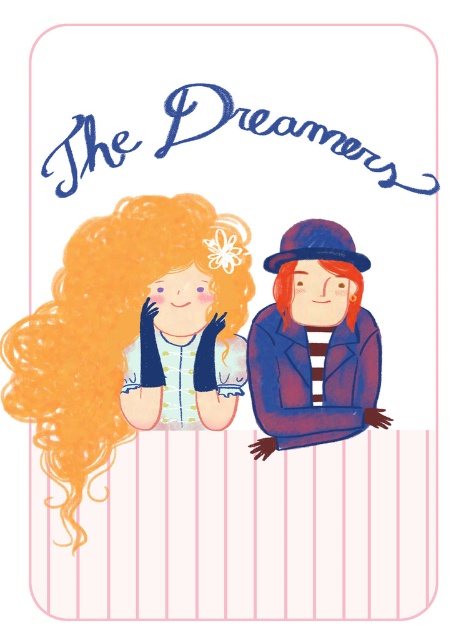
Does golden curly hair at left have a greater height compared to blonde curly hair at center?

Correct, golden curly hair at left is much taller as blonde curly hair at center.

Can you confirm if golden curly hair at left is positioned to the left of blonde curly hair at center?

Yes, golden curly hair at left is to the left of blonde curly hair at center.

Image resolution: width=466 pixels, height=640 pixels. I want to click on golden curly hair at left, so click(131, 337).

Who is positioned more to the left, matte blue hat at center or blonde curly hair at center?

Positioned to the left is blonde curly hair at center.

Where is `matte blue hat at center`? This screenshot has height=640, width=466. matte blue hat at center is located at coordinates (x=310, y=344).

Does point (305, 305) lie behind point (287, 264)?

Yes, it is behind point (287, 264).

Locate an element on the screen. matte blue hat at center is located at coordinates point(310,344).

Which is more to the right, golden curly hair at left or matte blue hat at center?

matte blue hat at center is more to the right.

Who is more distant from viewer, (84, 262) or (252, 328)?

The point (252, 328) is more distant.

Find the location of a particular element. This screenshot has height=640, width=466. golden curly hair at left is located at coordinates (131, 337).